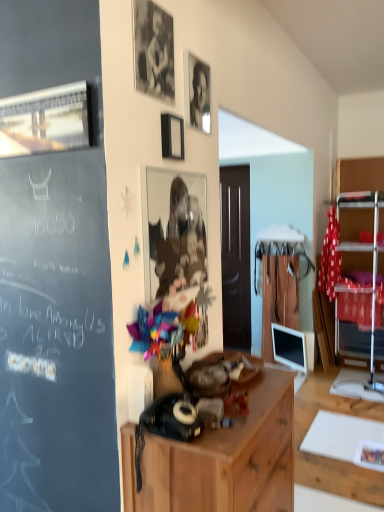
Question: Which direction should I rotate to look at metallic reflective photo frame at center, acting as the 4th picture frame starting from the left?

Choices:
 (A) left
 (B) right

Answer: (A)

Question: Is metallic silver picture frame at upper left, the first picture frame positioned from the left, bigger than black glossy photo frame at upper center?

Choices:
 (A) no
 (B) yes

Answer: (B)

Question: From the image's perspective, is metallic silver picture frame at upper left, which is counted as the third picture frame, starting from the top, located above black glossy photo frame at upper center?

Choices:
 (A) yes
 (B) no

Answer: (B)

Question: Is metallic silver picture frame at upper left, the first picture frame positioned from the left, positioned before black glossy photo frame at upper center?

Choices:
 (A) yes
 (B) no

Answer: (A)

Question: Does metallic silver picture frame at upper left, which is counted as the fourth picture frame, starting from the right, have a lesser width compared to black glossy photo frame at upper center?

Choices:
 (A) no
 (B) yes

Answer: (B)

Question: From a real-world perspective, is metallic silver picture frame at upper left, the first picture frame positioned from the left, physically below black glossy photo frame at upper center?

Choices:
 (A) no
 (B) yes

Answer: (B)

Question: Considering the relative sizes of metallic silver picture frame at upper left, which is counted as the third picture frame, starting from the top, and black glossy photo frame at upper center in the image provided, is metallic silver picture frame at upper left, which is counted as the third picture frame, starting from the top, shorter than black glossy photo frame at upper center?

Choices:
 (A) no
 (B) yes

Answer: (B)

Question: Is the depth of black matte photo frame at upper center, which is counted as the 1th picture frame, starting from the top, less than that of wooden cabinet at center?

Choices:
 (A) yes
 (B) no

Answer: (B)

Question: From a real-world perspective, is black matte photo frame at upper center, which is the 3th picture frame in right-to-left order, on wooden cabinet at center?

Choices:
 (A) no
 (B) yes

Answer: (B)

Question: Could you tell me if black matte photo frame at upper center, the second picture frame when ordered from left to right, is turned towards wooden cabinet at center?

Choices:
 (A) no
 (B) yes

Answer: (A)

Question: Can wooden cabinet at center be found inside black matte photo frame at upper center, the second picture frame when ordered from left to right?

Choices:
 (A) yes
 (B) no

Answer: (B)

Question: From the image's perspective, does black matte photo frame at upper center, acting as the 4th picture frame starting from the bottom, appear lower than wooden cabinet at center?

Choices:
 (A) no
 (B) yes

Answer: (A)

Question: Can you confirm if black matte photo frame at upper center, acting as the 4th picture frame starting from the bottom, is positioned to the left of wooden cabinet at center?

Choices:
 (A) yes
 (B) no

Answer: (A)

Question: Is black glossy photo frame at upper center taller than metallic silver picture frame at upper left, which is counted as the fourth picture frame, starting from the right?

Choices:
 (A) no
 (B) yes

Answer: (B)